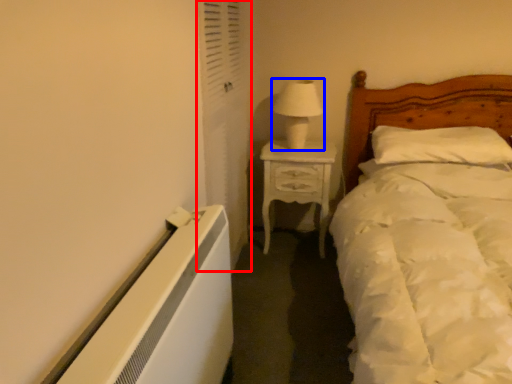
Question: Which point is further to the camera, screen door (highlighted by a red box) or table lamp (highlighted by a blue box)?

Choices:
 (A) screen door
 (B) table lamp

Answer: (B)